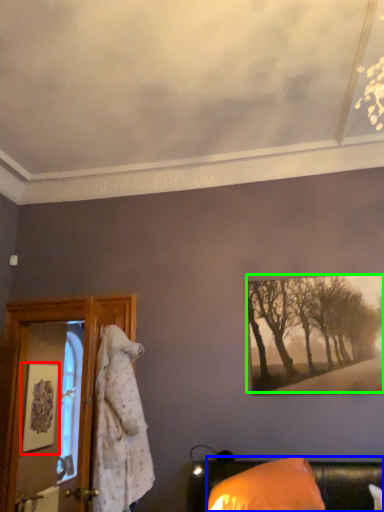
Question: Which object is the closest to the picture frame (highlighted by a red box)? Choose among these: furniture (highlighted by a blue box) or tree (highlighted by a green box).

Choices:
 (A) furniture
 (B) tree

Answer: (B)